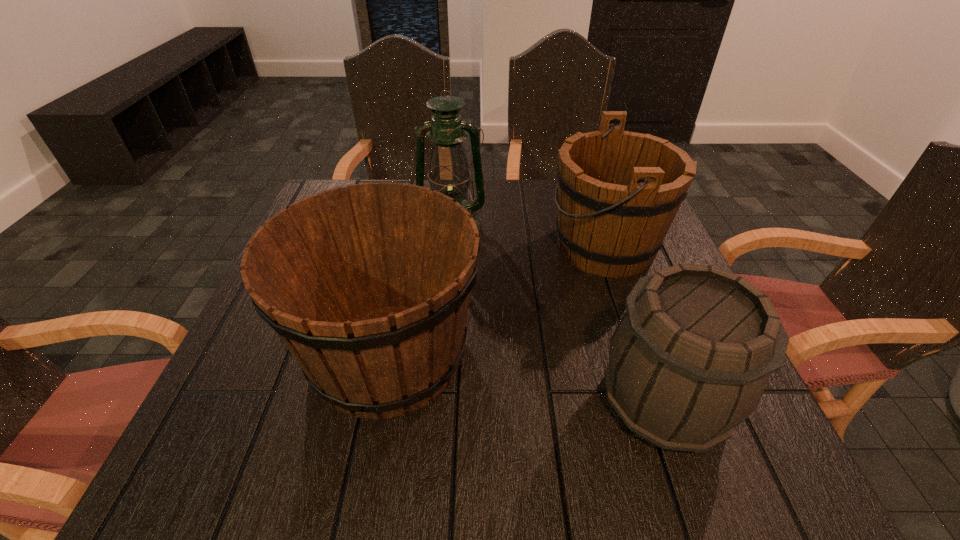
I want to click on vacant space that satisfies the following two spatial constraints: 1. on the back side of the oil lamp; 2. on the left side of the leftmost wine bucket, so click(414, 224).

The height and width of the screenshot is (540, 960). Find the location of `free region that satisfies the following two spatial constraints: 1. on the side of the farthest wine bucket with the handle for carrying; 2. on the front side of the leftmost wine bucket`. free region that satisfies the following two spatial constraints: 1. on the side of the farthest wine bucket with the handle for carrying; 2. on the front side of the leftmost wine bucket is located at coordinates (641, 353).